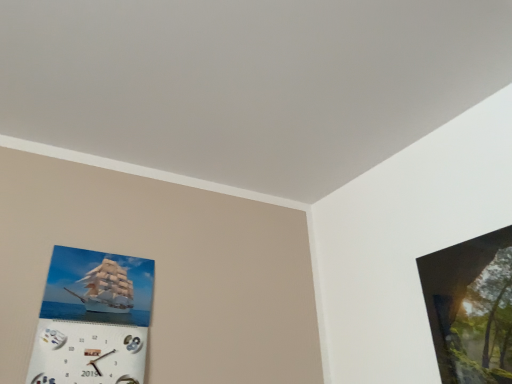
At what (x,y) coordinates should I click in order to perform the action: click on metallic calendar at lower left. Please return your answer as a coordinate pair (x, y). Looking at the image, I should click on (93, 319).

The image size is (512, 384). What do you see at coordinates (93, 319) in the screenshot?
I see `metallic calendar at lower left` at bounding box center [93, 319].

Measure the distance between point [113,371] and camera.

They are 4.69 feet apart.

I want to click on metallic calendar at lower left, so click(x=93, y=319).